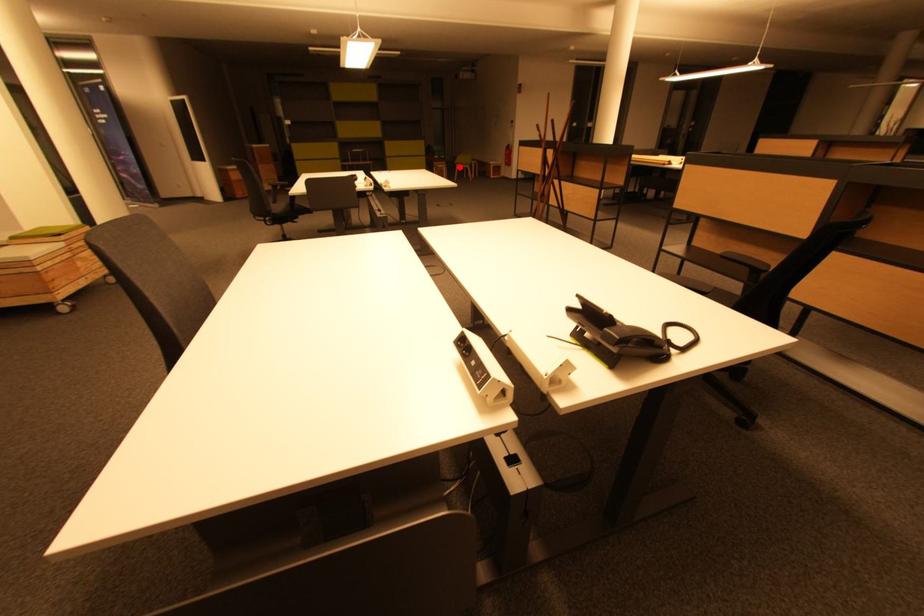
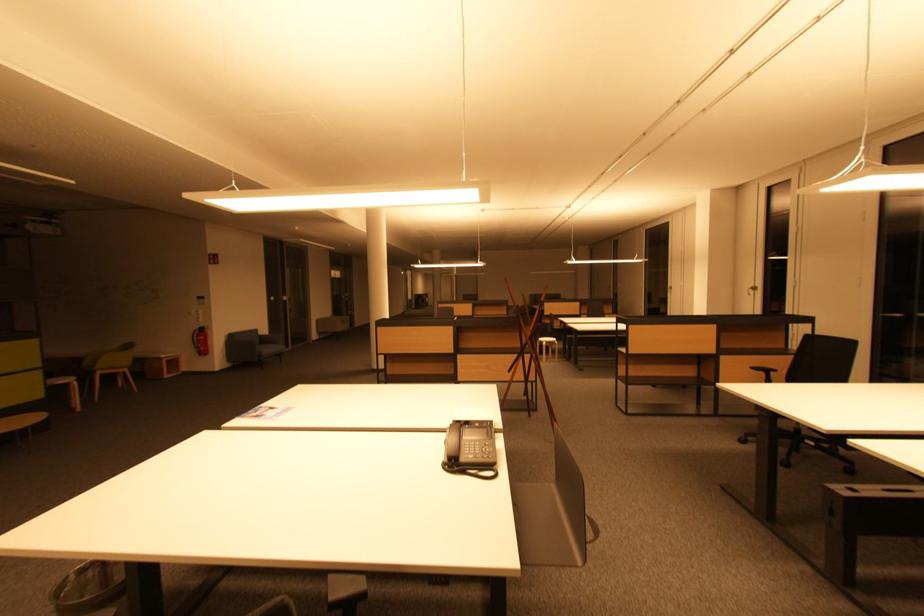
Find the pixel in the second image that matches the highlighted location in the first image.

(98, 374)